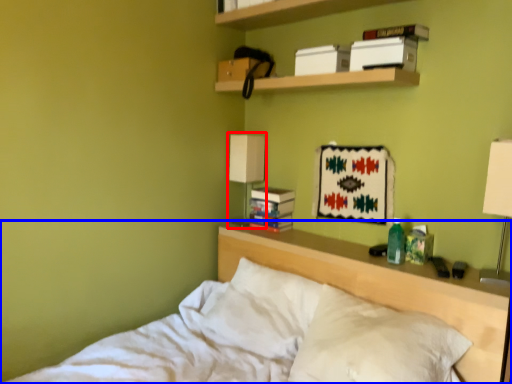
Question: Which object is closer to the camera taking this photo, lamp (highlighted by a red box) or bed (highlighted by a blue box)?

Choices:
 (A) lamp
 (B) bed

Answer: (B)